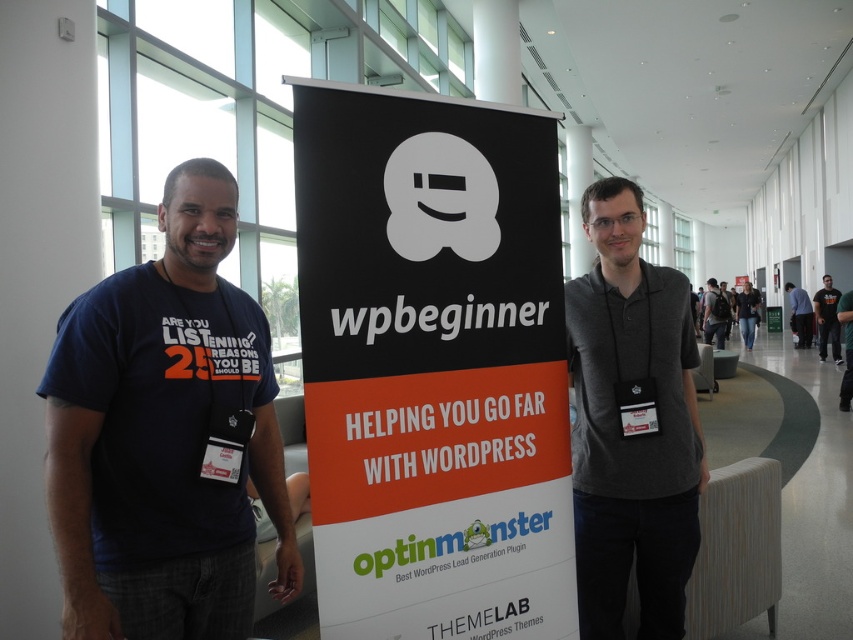
Can you confirm if black paper banner at center is taller than jeans at center?

No.

Who is lower down, black paper banner at center or jeans at center?

black paper banner at center is below.

Find the location of a particular element. black paper banner at center is located at coordinates (432, 365).

Can you confirm if gray fabric backpack at center is bigger than jeans at center?

Actually, gray fabric backpack at center might be smaller than jeans at center.

Measure the distance between point [701,317] and camera.

Point [701,317] and camera are 52.69 feet apart from each other.

You are a GUI agent. You are given a task and a screenshot of the screen. Output one action in this format:
    pyautogui.click(x=<x>, y=<y>)
    Task: Click on the gray fabric backpack at center
    Image resolution: width=853 pixels, height=640 pixels.
    Given the screenshot: What is the action you would take?
    pyautogui.click(x=714, y=314)

Measure the distance between black paper banner at center and gray fabric shirt at right.

16.85 meters

Between black paper banner at center and gray fabric shirt at right, which one has less height?

Standing shorter between the two is black paper banner at center.

Is point (325, 429) positioned behind point (798, 324)?

No, (325, 429) is closer to viewer.

Locate an element on the screen. The image size is (853, 640). black paper banner at center is located at coordinates (432, 365).